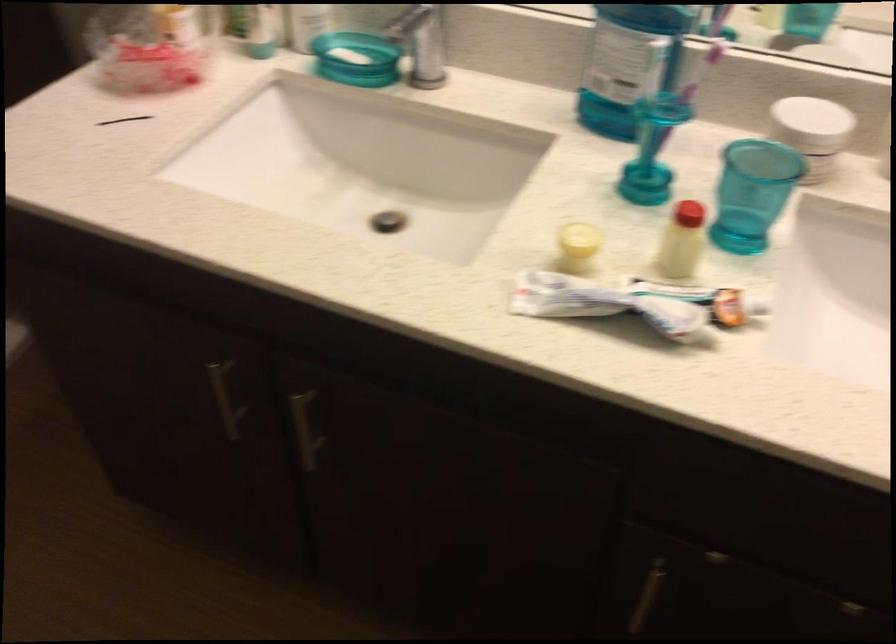
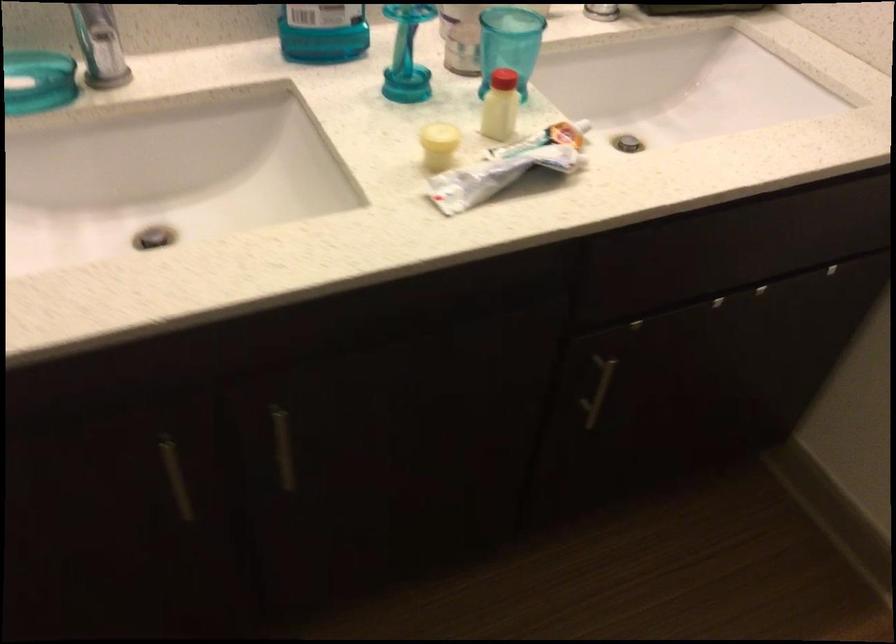
Locate, in the second image, the point that corresponds to the point at 657,154 in the first image.

(407, 55)